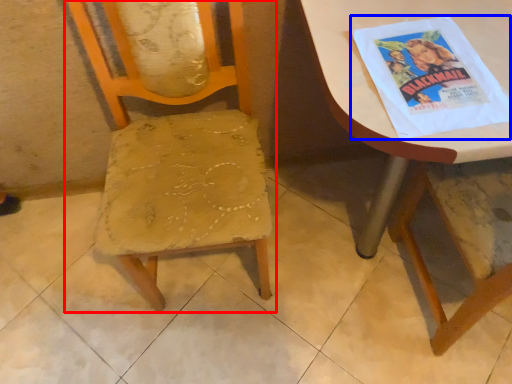
Question: Which object is further to the camera taking this photo, chair (highlighted by a red box) or comic book (highlighted by a blue box)?

Choices:
 (A) chair
 (B) comic book

Answer: (B)